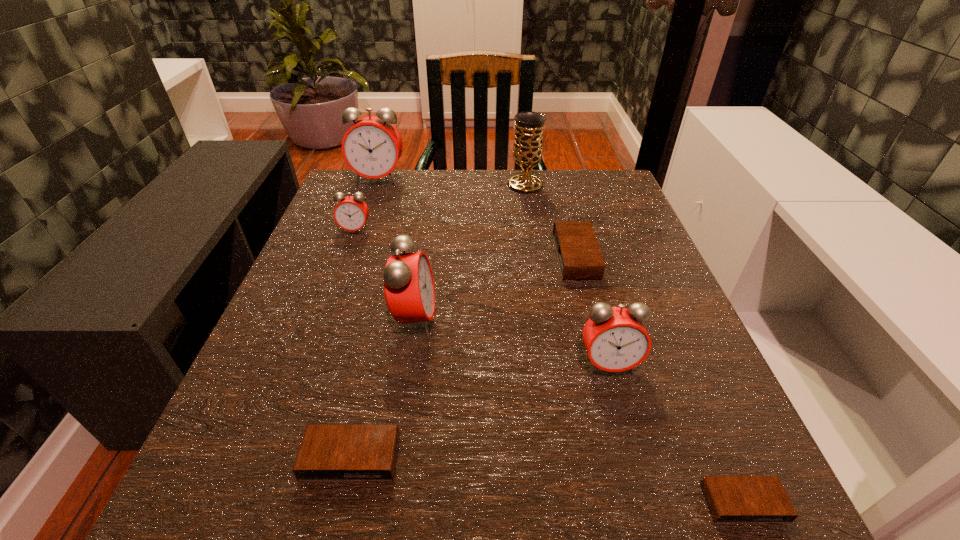
Where is `vacant area situated on the front face of the sixth tallest object`? Image resolution: width=960 pixels, height=540 pixels. vacant area situated on the front face of the sixth tallest object is located at coordinates (517, 256).

This screenshot has width=960, height=540. I want to click on free space located 0.220m on the front face of the sixth tallest object, so click(448, 256).

At what (x,y) coordinates should I click in order to perform the action: click on free space located 0.090m on the front face of the sixth tallest object. Please return your answer as a coordinate pair (x, y). Looking at the image, I should click on pos(513,256).

In order to click on alarm clock that is at the far edge in this screenshot , I will do click(372, 147).

What are the coordinates of `chalice situated at the far edge` in the screenshot? It's located at (528, 142).

Locate an element on the screen. This screenshot has width=960, height=540. object that is at the far left corner is located at coordinates (372, 147).

Locate an element on the screen. This screenshot has width=960, height=540. object situated at the near left corner is located at coordinates (327, 452).

Locate an element on the screen. object that is positioned at the near right corner is located at coordinates (731, 499).

Identify the location of vacant space at the far edge. (444, 198).

Where is `vacant area at the near edge of the desktop`? vacant area at the near edge of the desktop is located at coordinates (376, 537).